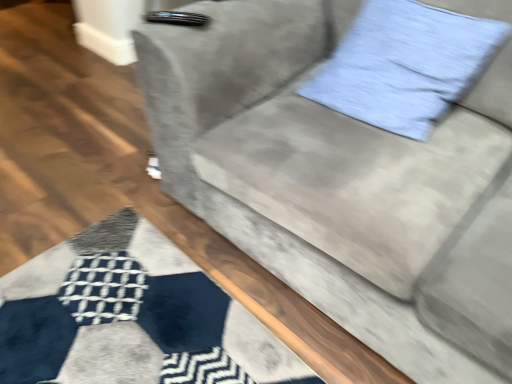
Question: Does velvet gray couch at center have a lesser height compared to light blue fabric pillow at upper right?

Choices:
 (A) no
 (B) yes

Answer: (A)

Question: Can light blue fabric pillow at upper right be found inside velvet gray couch at center?

Choices:
 (A) yes
 (B) no

Answer: (A)

Question: Can you confirm if velvet gray couch at center is wider than light blue fabric pillow at upper right?

Choices:
 (A) yes
 (B) no

Answer: (A)

Question: Is velvet gray couch at center positioned beyond the bounds of light blue fabric pillow at upper right?

Choices:
 (A) no
 (B) yes

Answer: (B)

Question: Is velvet gray couch at center positioned before light blue fabric pillow at upper right?

Choices:
 (A) no
 (B) yes

Answer: (B)

Question: From a real-world perspective, is velvet gray couch at center located beneath light blue fabric pillow at upper right?

Choices:
 (A) yes
 (B) no

Answer: (A)

Question: Are light blue fabric pillow at upper right and velvet gray couch at center making contact?

Choices:
 (A) no
 (B) yes

Answer: (A)

Question: Does light blue fabric pillow at upper right appear on the right side of velvet gray couch at center?

Choices:
 (A) yes
 (B) no

Answer: (A)

Question: Is velvet gray couch at center inside light blue fabric pillow at upper right?

Choices:
 (A) no
 (B) yes

Answer: (A)

Question: Does light blue fabric pillow at upper right have a lesser width compared to velvet gray couch at center?

Choices:
 (A) yes
 (B) no

Answer: (A)

Question: Does light blue fabric pillow at upper right have a smaller size compared to velvet gray couch at center?

Choices:
 (A) yes
 (B) no

Answer: (A)

Question: From the image's perspective, would you say light blue fabric pillow at upper right is shown under velvet gray couch at center?

Choices:
 (A) no
 (B) yes

Answer: (A)

Question: From their relative heights in the image, would you say velvet gray couch at center is taller or shorter than light blue fabric pillow at upper right?

Choices:
 (A) short
 (B) tall

Answer: (B)